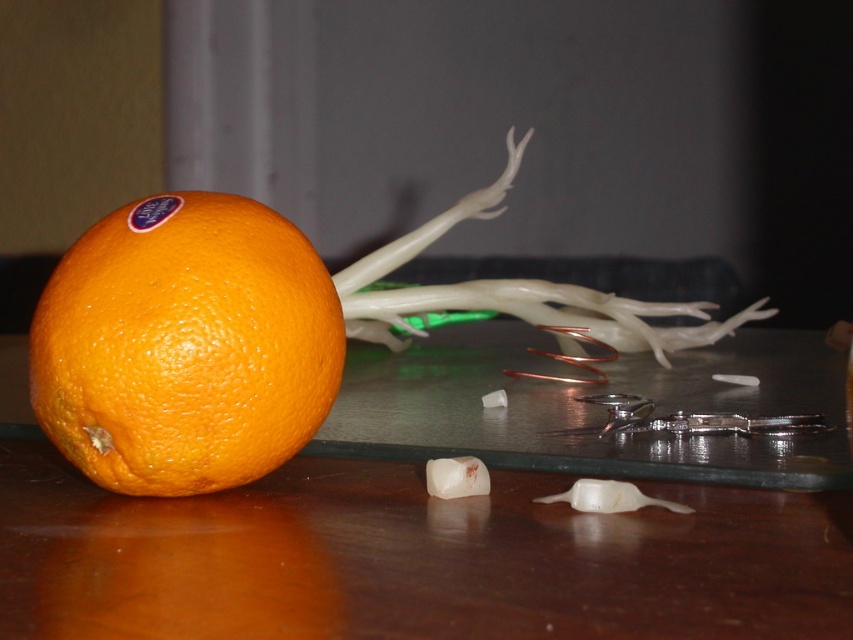
You are preparing to cut the translucent white onion at center on the wooden table at lower left. However, you notice the onion is placed higher than the table. Is the onion stable enough to cut safely?

The wooden table at lower left is located below the translucent white onion at center, meaning the onion is elevated above the table. This could make it unstable to cut safely. You should lower the onion onto the table first.

You are organizing a fruit basket and need to fit both the orangesmoothfruit at left and the translucent white onion at center into a small container. Based on their sizes, which fruit should you place first to ensure both fit properly?

The orangesmoothfruit at left occupies less space than the translucent white onion at center, so you should place the translucent white onion at center first to make space for the smaller fruit.